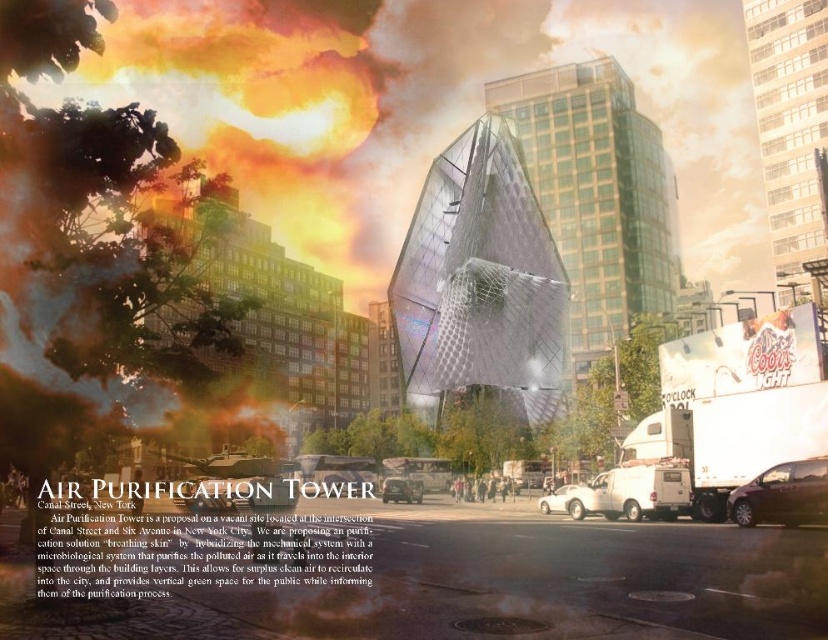
Measure the distance between shiny silver minivan at lower right and camera.

shiny silver minivan at lower right is 50.89 meters away from camera.

Between point (761, 516) and point (562, 506), which one is positioned in front?

Point (761, 516) is more forward.

Who is more forward, (x=798, y=484) or (x=549, y=493)?

Point (x=798, y=484) is more forward.

Locate an element on the screen. This screenshot has width=828, height=640. shiny silver minivan at lower right is located at coordinates (782, 496).

Between shiny silver minivan at lower right and metallic silver car at center, which one is positioned higher?

shiny silver minivan at lower right

The width and height of the screenshot is (828, 640). Describe the element at coordinates (782, 496) in the screenshot. I see `shiny silver minivan at lower right` at that location.

Between point (788, 461) and point (416, 492), which one is positioned in front?

Point (788, 461) is more forward.

Where is `shiny silver minivan at lower right`? The image size is (828, 640). shiny silver minivan at lower right is located at coordinates (782, 496).

Which is more to the left, metallic silver car at center or white matte car at center?

From the viewer's perspective, metallic silver car at center appears more on the left side.

This screenshot has width=828, height=640. Describe the element at coordinates (402, 490) in the screenshot. I see `metallic silver car at center` at that location.

Find the location of a particular element. metallic silver car at center is located at coordinates (402, 490).